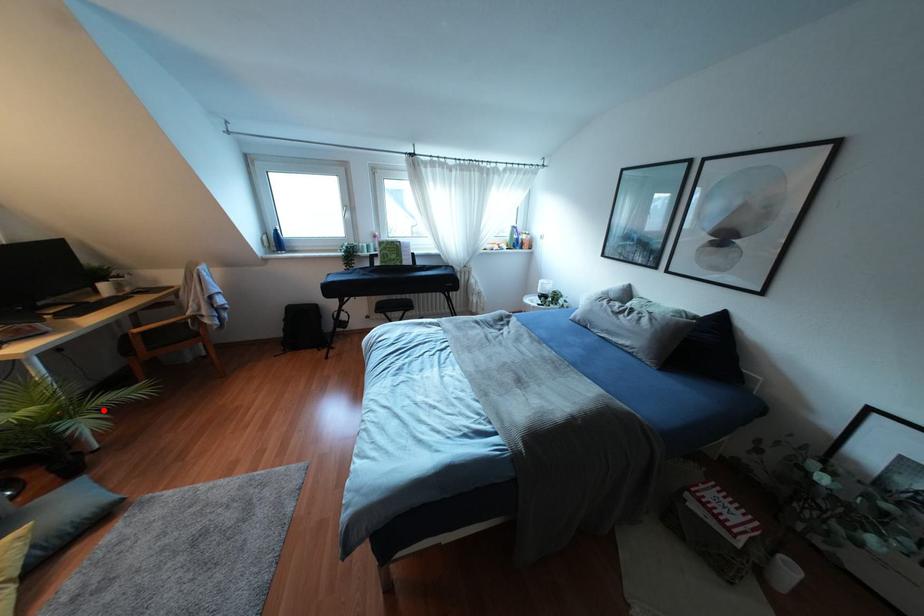
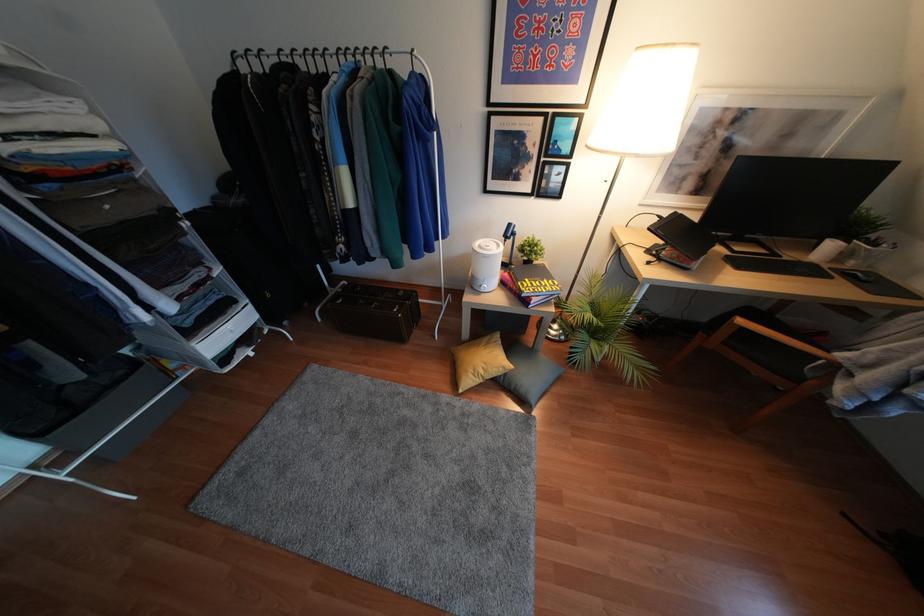
Question: A red point is marked in image1. In image2, is the corresponding 3D point closer to the camera or farther? Reply with the corresponding letter.

Choices:
 (A) The corresponding 3D point is closer.
 (B) The corresponding 3D point is farther.

Answer: (A)